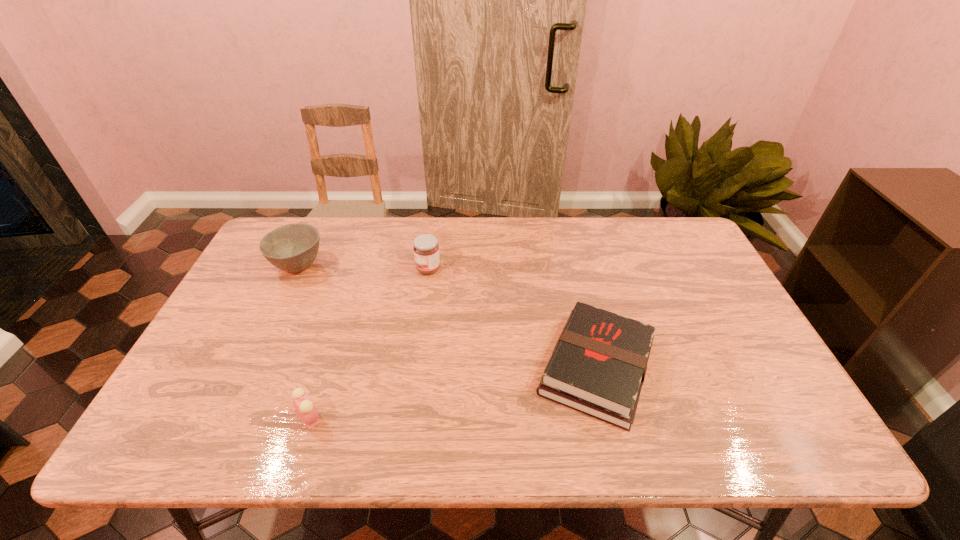
This screenshot has height=540, width=960. I want to click on hardback book that is positioned at the near edge, so click(x=598, y=366).

I want to click on object located in the left edge section of the desktop, so click(x=293, y=247).

You are a GUI agent. You are given a task and a screenshot of the screen. Output one action in this format:
    pyautogui.click(x=<x>, y=<y>)
    Task: Click on the object present at the far left corner
    This screenshot has height=540, width=960.
    Given the screenshot: What is the action you would take?
    pyautogui.click(x=293, y=247)

At what (x,y) coordinates should I click in order to perform the action: click on vacant space at the far edge of the desktop. Please return your answer as a coordinate pair (x, y). Image resolution: width=960 pixels, height=540 pixels. Looking at the image, I should click on (517, 218).

In the image, there is a desktop. At what (x,y) coordinates should I click in order to perform the action: click on vacant space at the near edge. Please return your answer as a coordinate pair (x, y). The width and height of the screenshot is (960, 540). Looking at the image, I should click on (572, 441).

In the image, there is a desktop. Where is `vacant area at the left edge`? The height and width of the screenshot is (540, 960). vacant area at the left edge is located at coordinates (235, 389).

In order to click on vacant space at the right edge of the desktop in this screenshot , I will do `click(734, 373)`.

Identify the location of empty space that is in between the second object from right to left and the rightmost object. (513, 319).

Locate an element on the screen. This screenshot has width=960, height=540. free space between the alarm clock and the hardback book is located at coordinates (453, 393).

The height and width of the screenshot is (540, 960). Identify the location of free space between the rightmost object and the bowl. (447, 316).